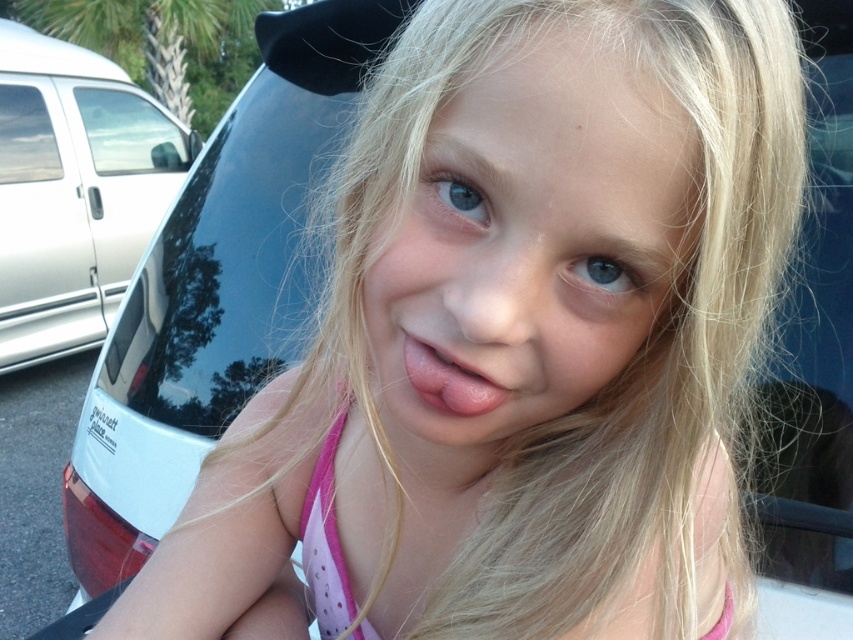
Is transparent glass car window at upper left positioned in front of transparent glass window at upper left?

No, it is behind transparent glass window at upper left.

Does transparent glass car window at upper left lie behind transparent glass window at upper left?

Yes, it is behind transparent glass window at upper left.

Between point (112, 150) and point (10, 145), which one is positioned behind?

Point (112, 150)

The width and height of the screenshot is (853, 640). Identify the location of transparent glass car window at upper left. (129, 132).

Which is more to the right, white metallic van at left or transparent glass window at upper left?

Positioned to the right is white metallic van at left.

Is point (62, 292) positioned before point (20, 112)?

No, it is not.

Identify the location of white metallic van at left. (74, 189).

Who is more distant from viewer, (51, 161) or (451, 368)?

Positioned behind is point (51, 161).

Is point (32, 179) positioned before point (463, 403)?

No.

This screenshot has height=640, width=853. Describe the element at coordinates (26, 136) in the screenshot. I see `transparent glass window at upper left` at that location.

Locate an element on the screen. The image size is (853, 640). transparent glass window at upper left is located at coordinates (26, 136).